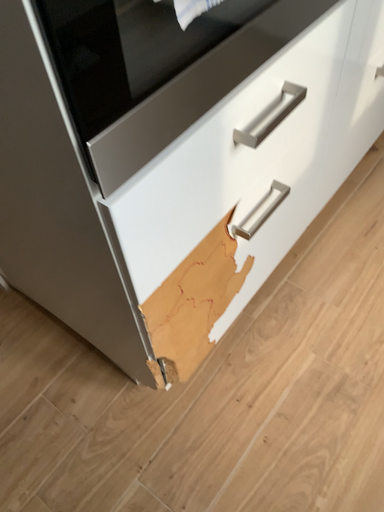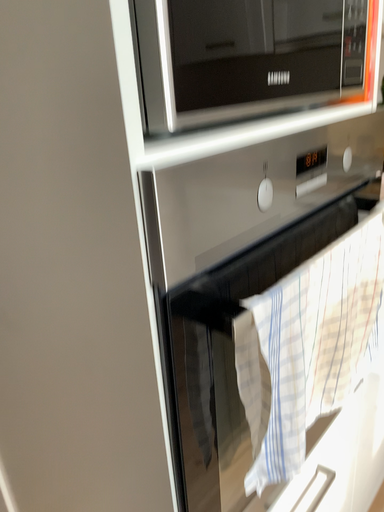
Question: Which way did the camera rotate in the video?

Choices:
 (A) rotated upward
 (B) rotated downward

Answer: (A)